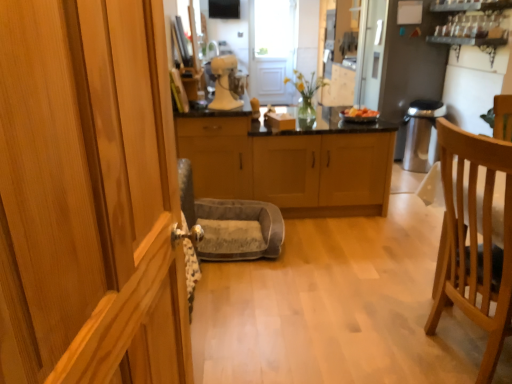
Question: From a real-world perspective, does light wood cabinetry at center, the 3th cabinetry in the left-to-right sequence, stand above smooth plastic bowl at center?

Choices:
 (A) yes
 (B) no

Answer: (B)

Question: Is light wood cabinetry at center, the 3th cabinetry in the left-to-right sequence, facing towards smooth plastic bowl at center?

Choices:
 (A) yes
 (B) no

Answer: (B)

Question: From a real-world perspective, is light wood cabinetry at center, which is the 3th cabinetry in front-to-back order, physically below smooth plastic bowl at center?

Choices:
 (A) yes
 (B) no

Answer: (A)

Question: From the image's perspective, is light wood cabinetry at center, the 3th cabinetry in the left-to-right sequence, below smooth plastic bowl at center?

Choices:
 (A) yes
 (B) no

Answer: (A)

Question: Considering the relative positions of light wood cabinetry at center, which ranks as the 1th cabinetry in back-to-front order, and smooth plastic bowl at center in the image provided, is light wood cabinetry at center, which ranks as the 1th cabinetry in back-to-front order, behind smooth plastic bowl at center?

Choices:
 (A) no
 (B) yes

Answer: (A)

Question: Is point (454, 269) closer or farther from the camera than point (42, 125)?

Choices:
 (A) closer
 (B) farther

Answer: (B)

Question: Looking at their shapes, would you say light brown wooden chair at right is wider or thinner than light brown wood cabinet at center, which is counted as the 2th cabinetry, starting from the left?

Choices:
 (A) thin
 (B) wide

Answer: (B)

Question: From a real-world perspective, relative to light brown wood cabinet at center, which is the third cabinetry in back-to-front order, is light brown wooden chair at right vertically above or below?

Choices:
 (A) above
 (B) below

Answer: (B)

Question: Would you say light brown wooden chair at right is to the left or to the right of light brown wood cabinet at center, which appears as the 1th cabinetry when viewed from the front, in the picture?

Choices:
 (A) right
 (B) left

Answer: (A)

Question: Visually, is light brown wooden chair at right positioned to the left or to the right of white matte stand mixer at center?

Choices:
 (A) left
 (B) right

Answer: (B)

Question: Based on their sizes in the image, would you say light brown wooden chair at right is bigger or smaller than white matte stand mixer at center?

Choices:
 (A) big
 (B) small

Answer: (A)

Question: Is light brown wooden chair at right inside the boundaries of white matte stand mixer at center, or outside?

Choices:
 (A) outside
 (B) inside

Answer: (A)

Question: From a real-world perspective, is light brown wooden chair at right above or below white matte stand mixer at center?

Choices:
 (A) below
 (B) above

Answer: (A)

Question: From the image's perspective, relative to light brown wood cabinet at center, which is counted as the 2th cabinetry, starting from the left, is light wood cabinetry at center, arranged as the first cabinetry when viewed from the right, above or below?

Choices:
 (A) above
 (B) below

Answer: (A)

Question: In terms of width, does light wood cabinetry at center, which ranks as the 1th cabinetry in back-to-front order, look wider or thinner when compared to light brown wood cabinet at center, which appears as the 1th cabinetry when viewed from the front?

Choices:
 (A) wide
 (B) thin

Answer: (A)